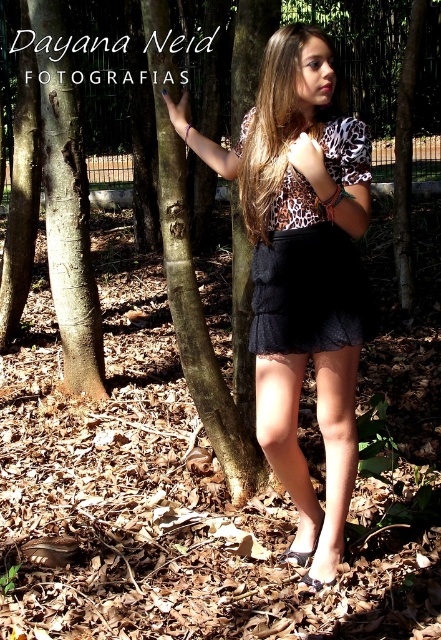
Question: Estimate the real-world distances between objects in this image. Which object is closer to the brown silky hair at center?

Choices:
 (A) black lace skirt at center
 (B) black lace dress at center
 (C) matte black skirt at center
 (D) brown rough tree trunk at left

Answer: (B)

Question: Can you confirm if matte black skirt at center is positioned to the right of black lace skirt at center?

Choices:
 (A) yes
 (B) no

Answer: (B)

Question: Does matte black skirt at center have a smaller size compared to brown rough tree trunk at left?

Choices:
 (A) yes
 (B) no

Answer: (B)

Question: Is brown rough tree trunk at left bigger than brown silky hair at center?

Choices:
 (A) no
 (B) yes

Answer: (B)

Question: Which of the following is the closest to the observer?

Choices:
 (A) (268, 88)
 (B) (340, 316)
 (C) (299, 288)

Answer: (A)

Question: Which of these objects is positioned farthest from the black lace skirt at center?

Choices:
 (A) brown rough tree trunk at left
 (B) black lace dress at center
 (C) matte black skirt at center
 (D) brown silky hair at center

Answer: (A)